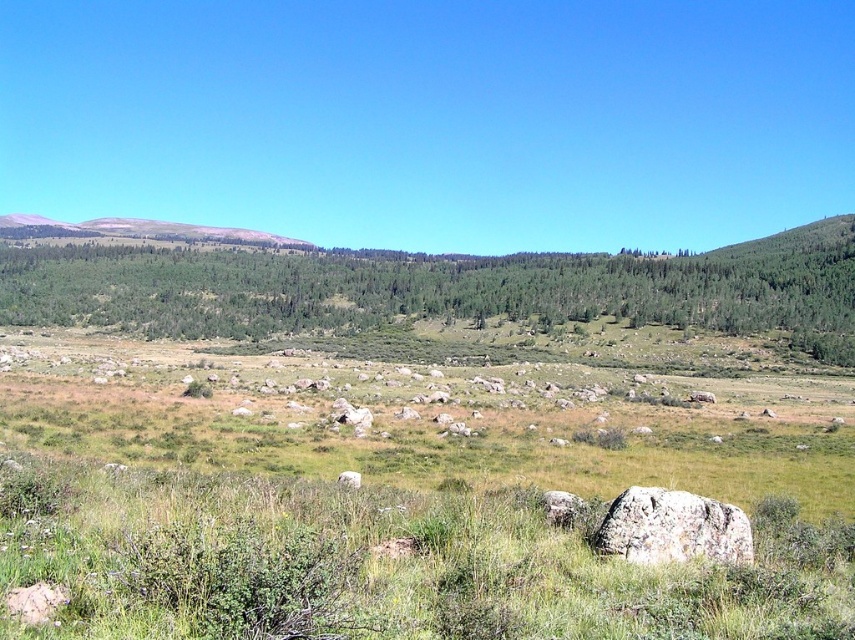
Question: Is smooth gray mountain at upper left positioned before gray rough stone at center?

Choices:
 (A) yes
 (B) no

Answer: (B)

Question: Estimate the real-world distances between objects in this image. Which object is closer to the smooth gray mountain at upper left?

Choices:
 (A) gray rough stone at center
 (B) gray rough boulder at lower right

Answer: (B)

Question: Which point appears farthest from the camera in this image?

Choices:
 (A) (615, 516)
 (B) (284, 244)
 (C) (340, 481)

Answer: (B)

Question: Which of the following is the farthest from the observer?

Choices:
 (A) gray rough stone at center
 (B) gray rough boulder at lower right

Answer: (A)

Question: Does gray rough boulder at lower right have a larger size compared to smooth gray mountain at upper left?

Choices:
 (A) no
 (B) yes

Answer: (A)

Question: Does smooth gray mountain at upper left have a larger size compared to gray rough stone at center?

Choices:
 (A) no
 (B) yes

Answer: (B)